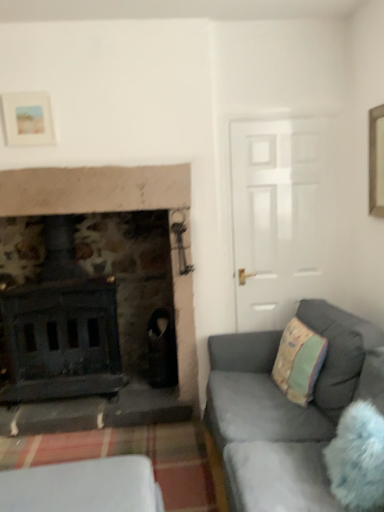
Question: Looking at their shapes, would you say white plastic container at lower left is wider or thinner than fluffy white pillow at lower right?

Choices:
 (A) wide
 (B) thin

Answer: (A)

Question: Is point (125, 464) positioned closer to the camera than point (374, 483)?

Choices:
 (A) farther
 (B) closer

Answer: (A)

Question: Which is farther from the pastel green fabric pillow at right?

Choices:
 (A) velvet grey couch at lower right
 (B) fluffy white pillow at lower right
 (C) white plastic container at lower left
 (D) matte white picture frame at upper left

Answer: (D)

Question: Which is nearer to the velvet grey couch at lower right?

Choices:
 (A) matte white picture frame at upper left
 (B) white plastic container at lower left
 (C) fluffy white pillow at lower right
 (D) pastel green fabric pillow at right

Answer: (D)